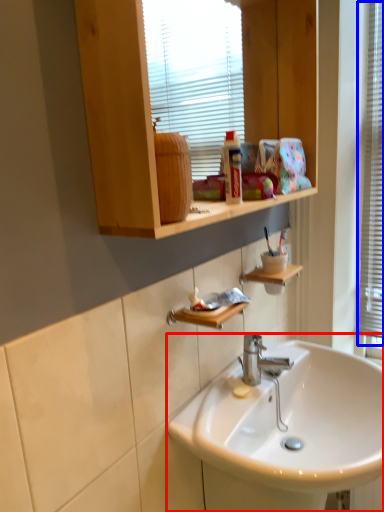
Question: Among these objects, which one is nearest to the camera, sink (highlighted by a red box) or window frame (highlighted by a blue box)?

Choices:
 (A) sink
 (B) window frame

Answer: (A)